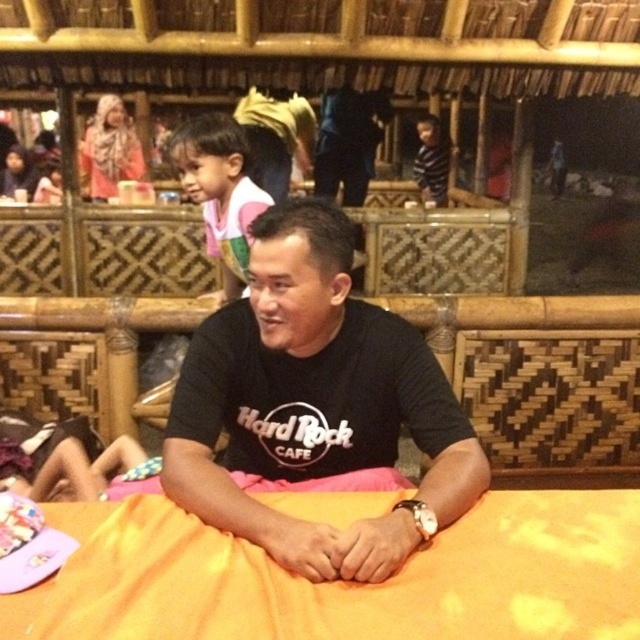
Question: Considering the real-world distances, which object is farthest from the orange fabric bed at center?

Choices:
 (A) black matte shirt at center
 (B) pink cotton shirt at upper left

Answer: (A)

Question: Is black matte shirt at center positioned behind pink cotton shirt at upper left?

Choices:
 (A) no
 (B) yes

Answer: (A)

Question: Which point is closer to the camera taking this photo?

Choices:
 (A) (237, 202)
 (B) (298, 316)

Answer: (B)

Question: Which of the following is the closest to the observer?

Choices:
 (A) (227, 218)
 (B) (573, 531)

Answer: (B)

Question: Does orange fabric bed at center have a larger size compared to pink cotton shirt at upper left?

Choices:
 (A) yes
 (B) no

Answer: (B)

Question: Can you confirm if black matte shirt at center is smaller than pink cotton shirt at upper left?

Choices:
 (A) yes
 (B) no

Answer: (B)